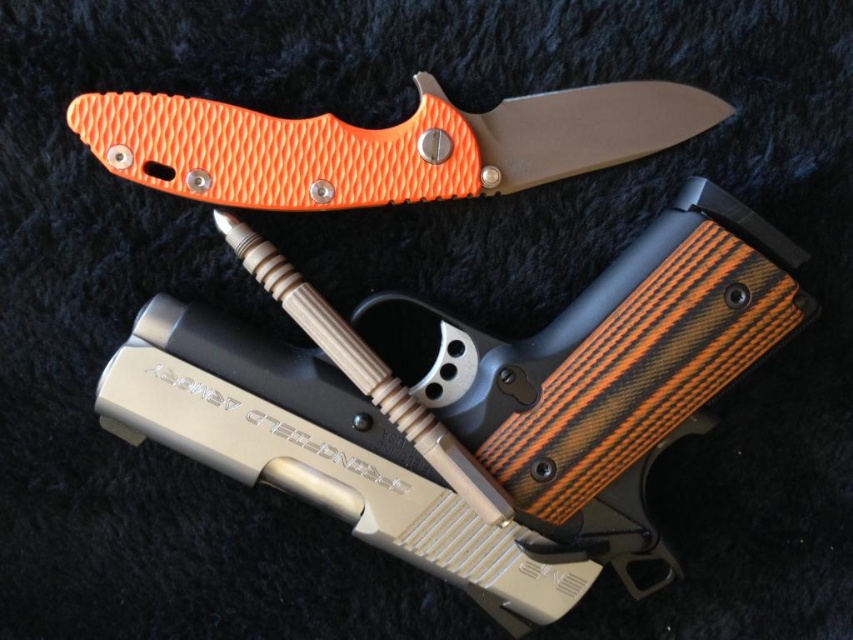
Which is in front, point (103, 388) or point (419, 188)?

Point (103, 388)

Is point (125, 417) farther from viewer compared to point (126, 129)?

Yes, point (125, 417) is farther from viewer.

Find the location of a particular element. The width and height of the screenshot is (853, 640). wooden-textured handgun at center is located at coordinates (477, 404).

The width and height of the screenshot is (853, 640). Identify the location of wooden-textured handgun at center. (477, 404).